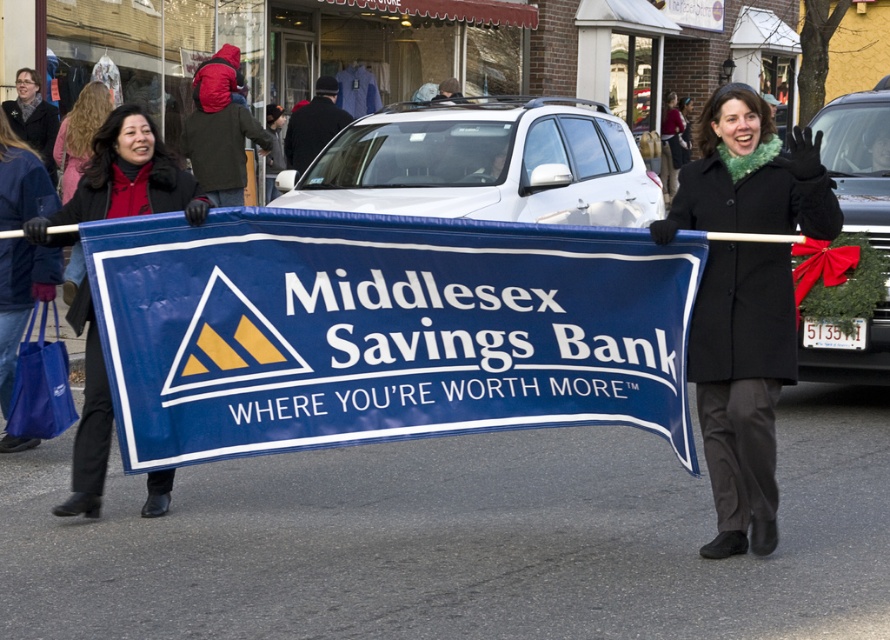
Question: Is black wool coat at center to the left of matte black coat at center from the viewer's perspective?

Choices:
 (A) no
 (B) yes

Answer: (A)

Question: Which point appears farthest from the camera in this image?

Choices:
 (A) (99, 179)
 (B) (498, 403)

Answer: (A)

Question: Does black wool coat at center appear over matte black coat at center?

Choices:
 (A) yes
 (B) no

Answer: (B)

Question: Can you confirm if black wool coat at center is positioned below matte black coat at center?

Choices:
 (A) yes
 (B) no

Answer: (A)

Question: Considering the real-world distances, which object is closest to the black wool coat at center?

Choices:
 (A) blue fabric banner at center
 (B) matte black coat at center

Answer: (A)

Question: Which object is farther from the camera taking this photo?

Choices:
 (A) black wool coat at center
 (B) blue fabric banner at center

Answer: (B)